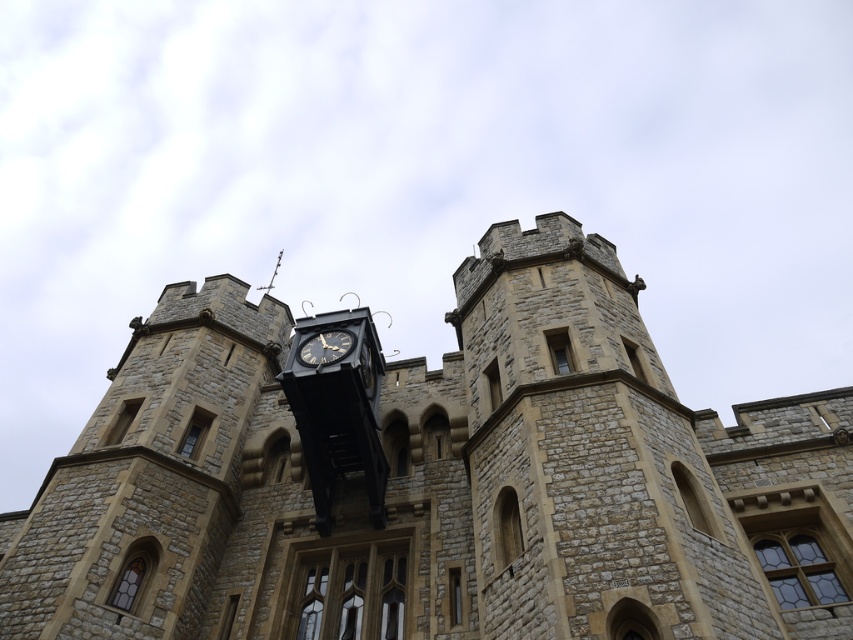
Question: Can you confirm if stone clock tower at center is positioned to the left of black metal clock at center?

Choices:
 (A) yes
 (B) no

Answer: (B)

Question: Which object appears farthest from the camera in this image?

Choices:
 (A) stone clock tower at center
 (B) black metal clock at center

Answer: (B)

Question: Which object is farther from the camera taking this photo?

Choices:
 (A) stone clock tower at center
 (B) black metal clock at center

Answer: (B)

Question: Is stone clock tower at center to the left of black metal clock at center from the viewer's perspective?

Choices:
 (A) yes
 (B) no

Answer: (B)

Question: Is stone clock tower at center bigger than black metal clock at center?

Choices:
 (A) no
 (B) yes

Answer: (B)